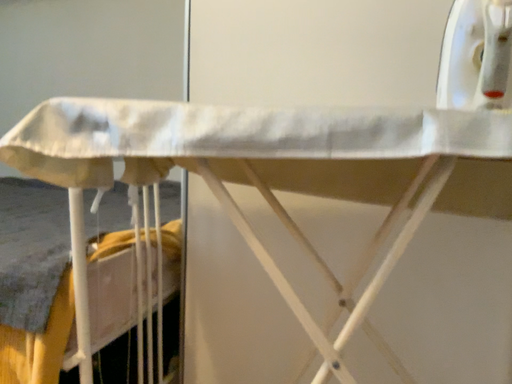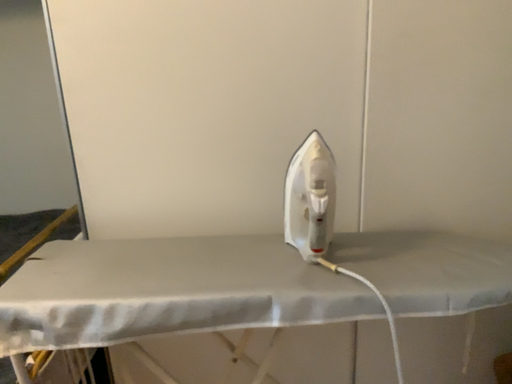
Question: Which way did the camera rotate in the video?

Choices:
 (A) rotated downward
 (B) rotated upward

Answer: (A)